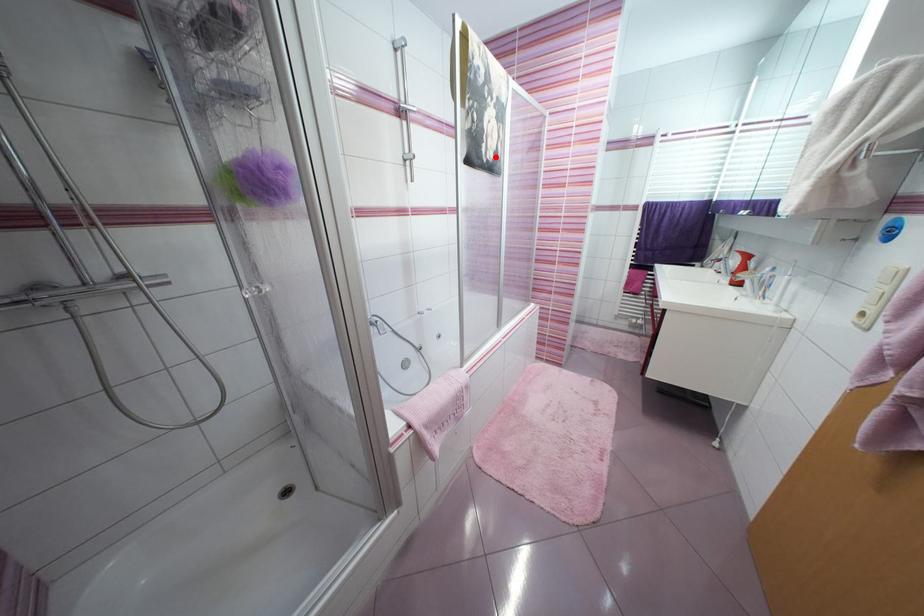
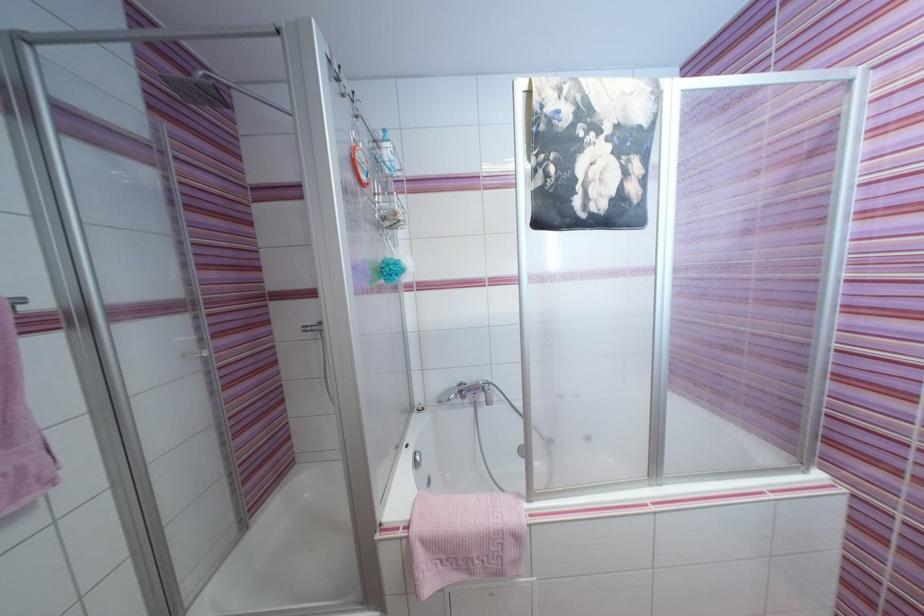
Where in the second image is the point corresponding to the highlighted location from the first image?

(604, 208)